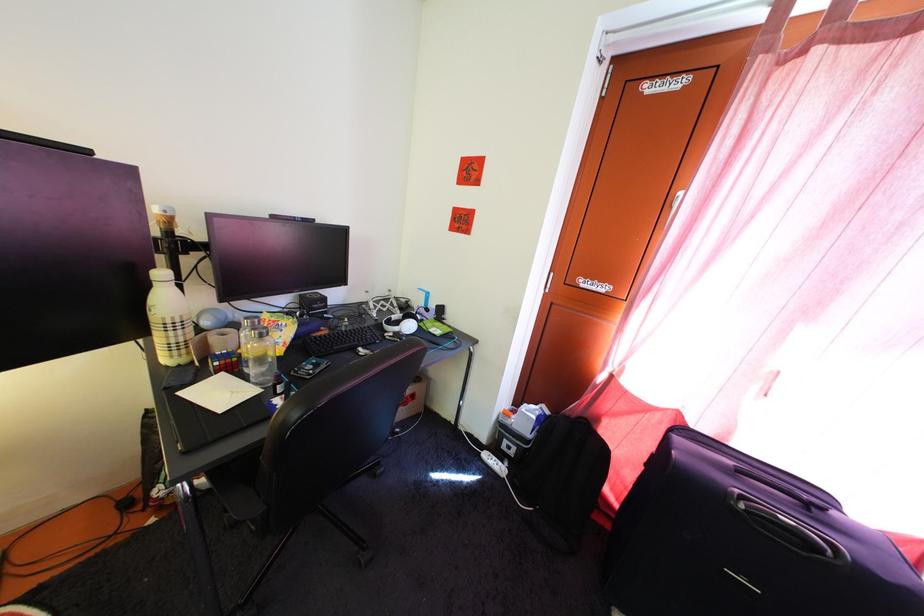
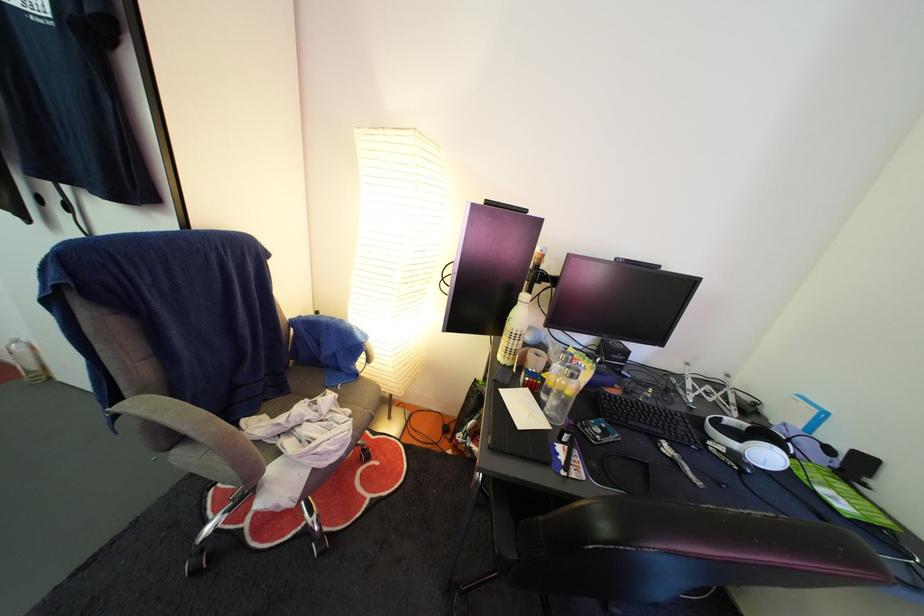
Find the pixel in the second image that matches (418,334) in the first image.

(774, 464)